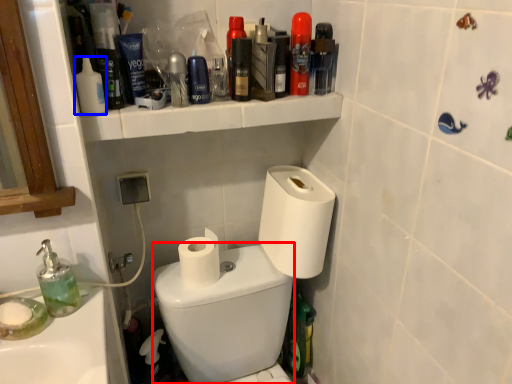
Question: Which of the following is the farthest to the observer, bidet (highlighted by a red box) or mouthwash (highlighted by a blue box)?

Choices:
 (A) bidet
 (B) mouthwash

Answer: (B)